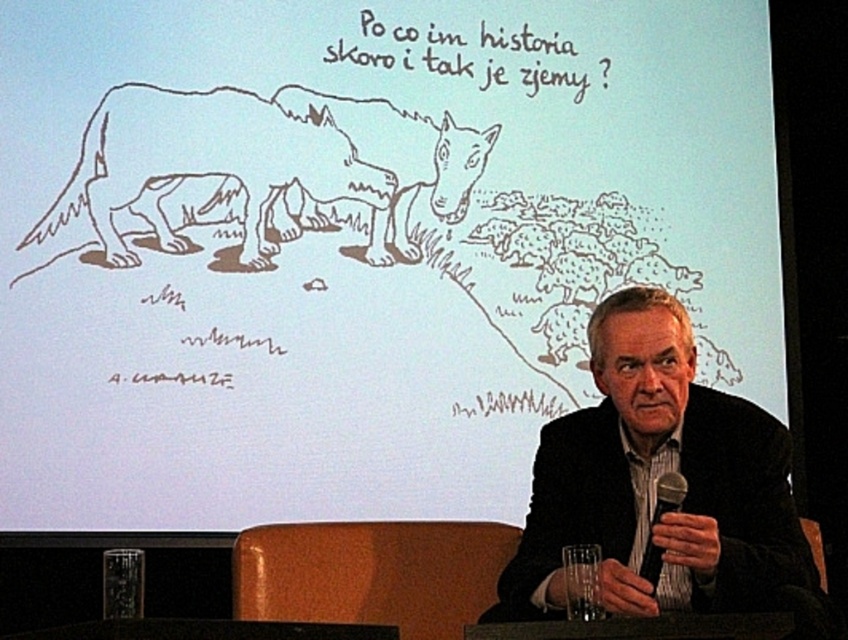
You are an event organizer setting up for a presentation. You need to ensure that the black textured suit at center worn by the presenter is visible to the audience. Considering the placement of the black metallic microphone at lower center, will the microphone block the view of the presenter?

The black textured suit at center has a greater height compared to the black metallic microphone at lower center. Since the suit is taller, the microphone will not block the view of the presenter.

You are an attendee at this presentation. You notice the brown sketchy wolf at upper left and the black metallic microphone at lower center. Which object is closer to you?

The brown sketchy wolf at upper left is closer to you because it is further to the viewer than the black metallic microphone at lower center.